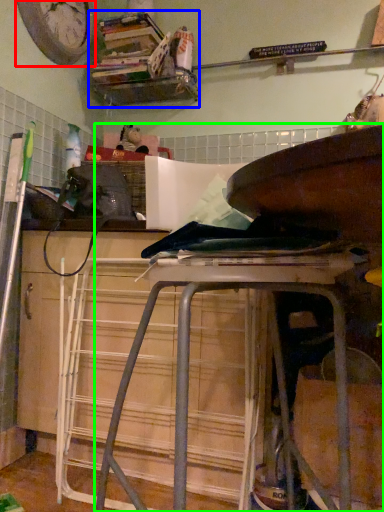
Question: Estimate the real-world distances between objects in this image. Which object is closer to clock (highlighted by a red box), shelf (highlighted by a blue box) or furniture (highlighted by a green box)?

Choices:
 (A) shelf
 (B) furniture

Answer: (A)